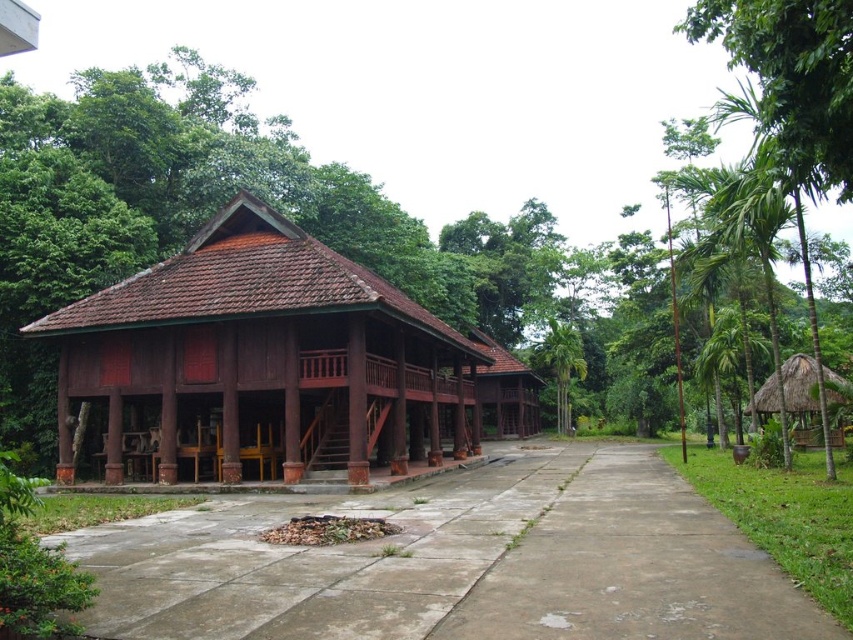
Does matte wood hut at center appear on the right side of thatched straw hut at right?

In fact, matte wood hut at center is to the left of thatched straw hut at right.

Is the position of matte wood hut at center more distant than that of thatched straw hut at right?

No.

Where is `matte wood hut at center`? Image resolution: width=853 pixels, height=640 pixels. matte wood hut at center is located at coordinates (262, 358).

You are a GUI agent. You are given a task and a screenshot of the screen. Output one action in this format:
    pyautogui.click(x=<x>, y=<y>)
    Task: Click on the matte wood hut at center
    Image resolution: width=853 pixels, height=640 pixels.
    Given the screenshot: What is the action you would take?
    pyautogui.click(x=262, y=358)

Between thatched straw hut at right and green leafy palm tree at center-right, which one is positioned lower?

Positioned lower is thatched straw hut at right.

From the picture: Who is shorter, thatched straw hut at right or green leafy palm tree at center-right?

With less height is thatched straw hut at right.

Is point (799, 378) farther from camera compared to point (570, 355)?

That is False.

Where is `thatched straw hut at right`? The height and width of the screenshot is (640, 853). thatched straw hut at right is located at coordinates (801, 397).

In the scene shown: Measure the distance between concrete at center and green leafy palm tree at center-right.

concrete at center is 32.83 meters away from green leafy palm tree at center-right.

Where is `concrete at center`? concrete at center is located at coordinates (456, 561).

Is point (120, 572) closer to viewer compared to point (563, 390)?

Yes, it is.

This screenshot has height=640, width=853. I want to click on concrete at center, so click(456, 561).